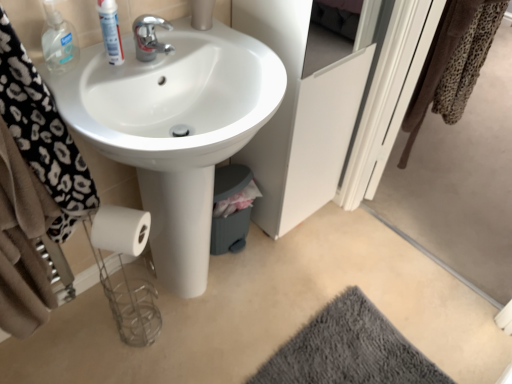
Locate an element on the screen. vacant location behind gray fuzzy rug at lower right is located at coordinates (340, 268).